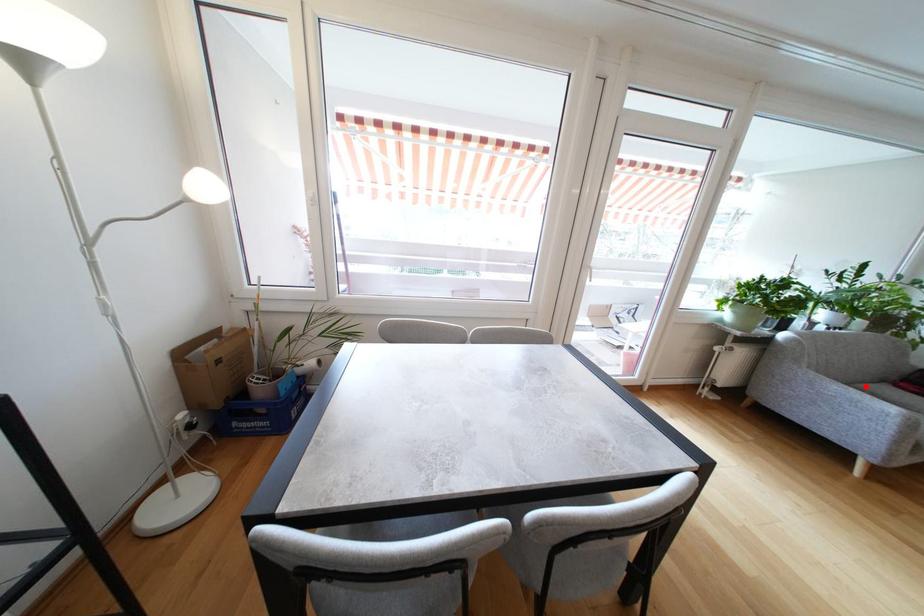
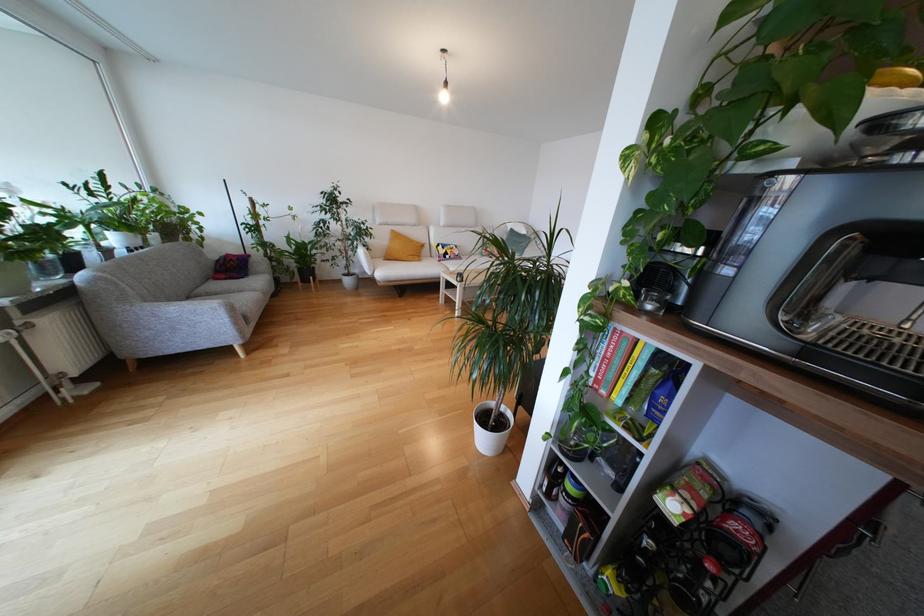
In the second image, find the point that corresponds to the highlighted location in the first image.

(201, 292)